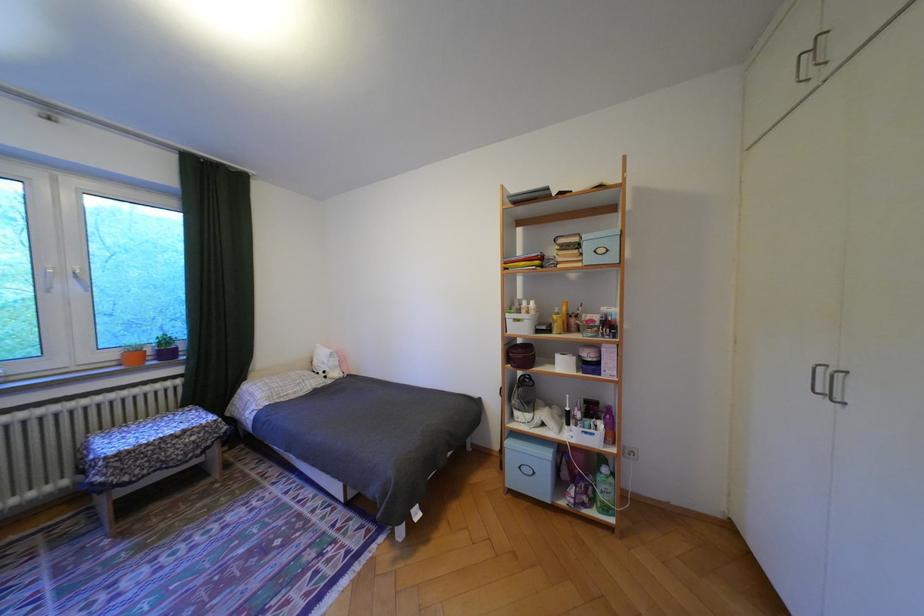
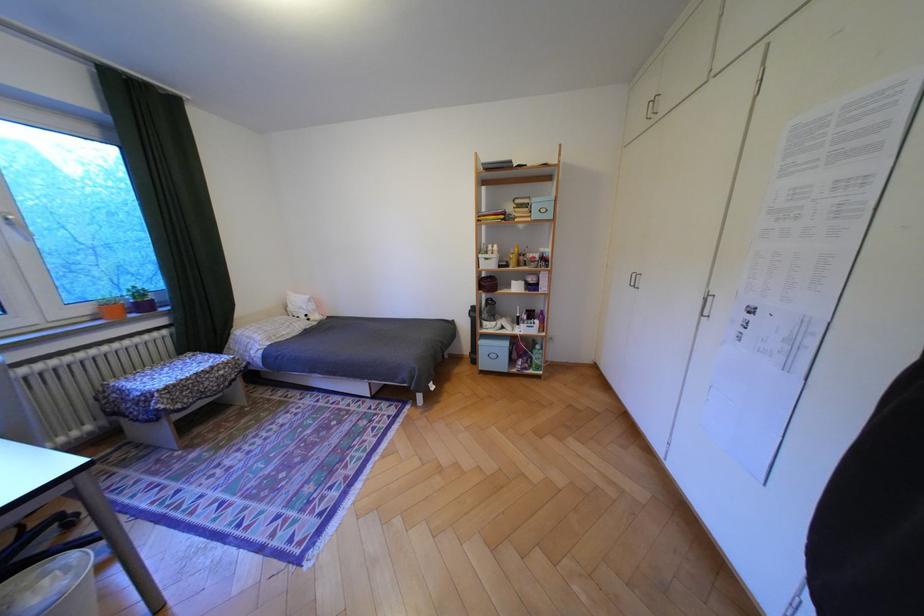
Find the pixel in the second image that matches (596,505) in the first image.

(538, 369)